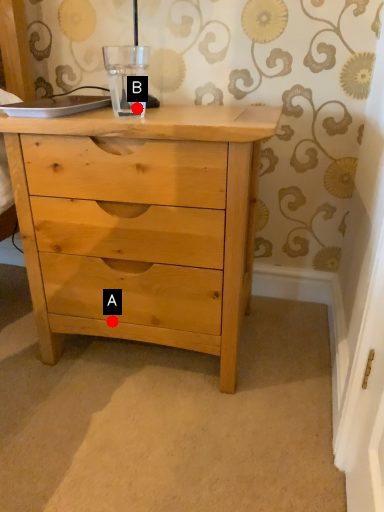
Question: Two points are circled on the image, labeled by A and B beside each circle. Among these points, which one is nearest to the camera?

Choices:
 (A) A is closer
 (B) B is closer

Answer: (B)